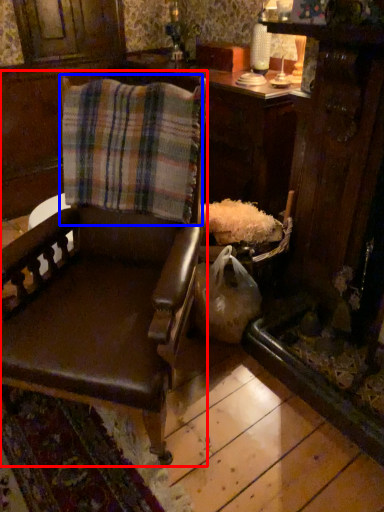
Question: Which object is further to the camera taking this photo, chair (highlighted by a red box) or flannel (highlighted by a blue box)?

Choices:
 (A) chair
 (B) flannel

Answer: (B)